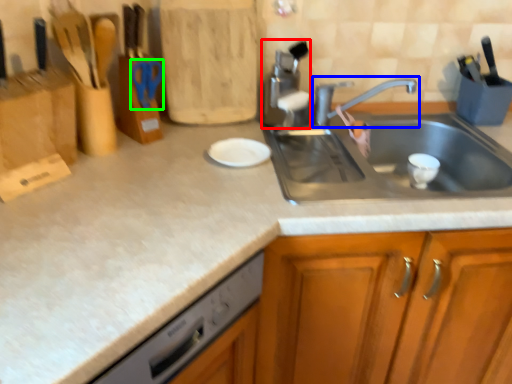
Question: Which object is the closest to the appliance (highlighted by a red box)? Choose among these: tap (highlighted by a blue box) or scissors (highlighted by a green box).

Choices:
 (A) tap
 (B) scissors

Answer: (A)